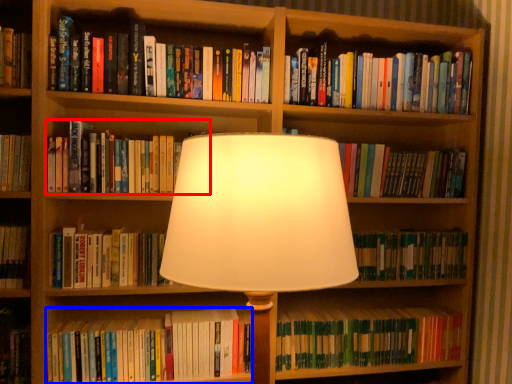
Question: Which point is further to the camera, book (highlighted by a red box) or book (highlighted by a blue box)?

Choices:
 (A) book
 (B) book

Answer: (B)